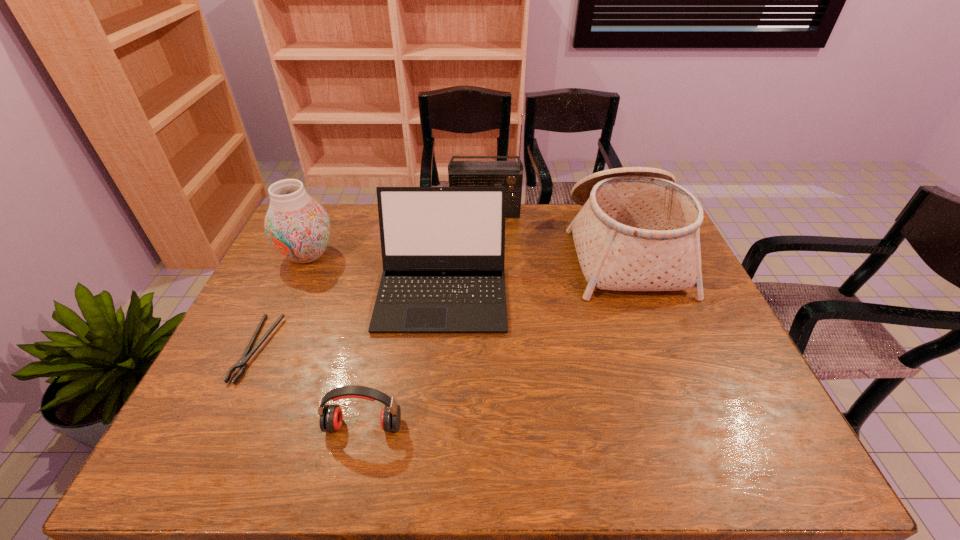
Where is `the tallest object`? the tallest object is located at coordinates (509, 174).

This screenshot has width=960, height=540. Find the location of `basket`. basket is located at coordinates (638, 230).

At what (x,y) coordinates should I click in order to perform the action: click on laptop. Please return your answer as a coordinate pair (x, y). Looking at the image, I should click on (443, 248).

Locate an element on the screen. vase is located at coordinates (298, 227).

Locate an element on the screen. The height and width of the screenshot is (540, 960). the nearest object is located at coordinates (331, 417).

At what (x,y) coordinates should I click in order to perform the action: click on the second shortest object. Please return your answer as a coordinate pair (x, y). This screenshot has width=960, height=540. Looking at the image, I should click on (331, 417).

Find the location of a particular element. The width and height of the screenshot is (960, 540). the shortest object is located at coordinates (242, 363).

The width and height of the screenshot is (960, 540). In order to click on vacant area situated on the front panel of the tallest object in this screenshot , I will do `click(486, 239)`.

Locate an element on the screen. vacant area situated 0.050m with the lid open on the rightmost object is located at coordinates tap(555, 249).

This screenshot has height=540, width=960. I want to click on vacant area located 0.320m with the lid open on the rightmost object, so click(x=474, y=249).